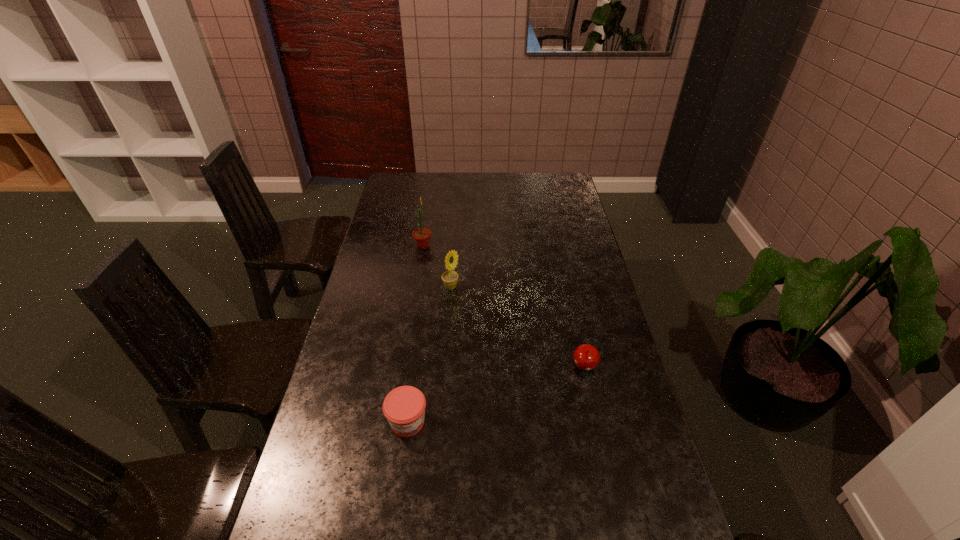
What are the coordinates of `the farther sunflower` in the screenshot? It's located at (421, 235).

Identify the location of the farthest object. The image size is (960, 540). (421, 235).

Find the location of a particular element. Image resolution: width=960 pixels, height=540 pixels. the second object from right to left is located at coordinates (450, 278).

Image resolution: width=960 pixels, height=540 pixels. What are the coordinates of `the right sunflower` in the screenshot? It's located at (450, 278).

The image size is (960, 540). I want to click on cherry, so click(x=586, y=357).

This screenshot has height=540, width=960. What are the coordinates of `the second nearest object` in the screenshot? It's located at (586, 357).

Find the location of a particular element. The height and width of the screenshot is (540, 960). the nearest object is located at coordinates (404, 407).

You are a GUI agent. You are given a task and a screenshot of the screen. Output one action in this format:
    pyautogui.click(x=<x>, y=<y>)
    Task: Click on the vacant area situated on the face of the taller sunflower
    This screenshot has height=540, width=960.
    Given the screenshot: What is the action you would take?
    pyautogui.click(x=522, y=246)

Image resolution: width=960 pixels, height=540 pixels. Identify the location of vacant space located on the face of the right sunflower. (476, 287).

Image resolution: width=960 pixels, height=540 pixels. In order to click on blank space located 0.270m on the back of the cherry in this screenshot , I will do `click(569, 295)`.